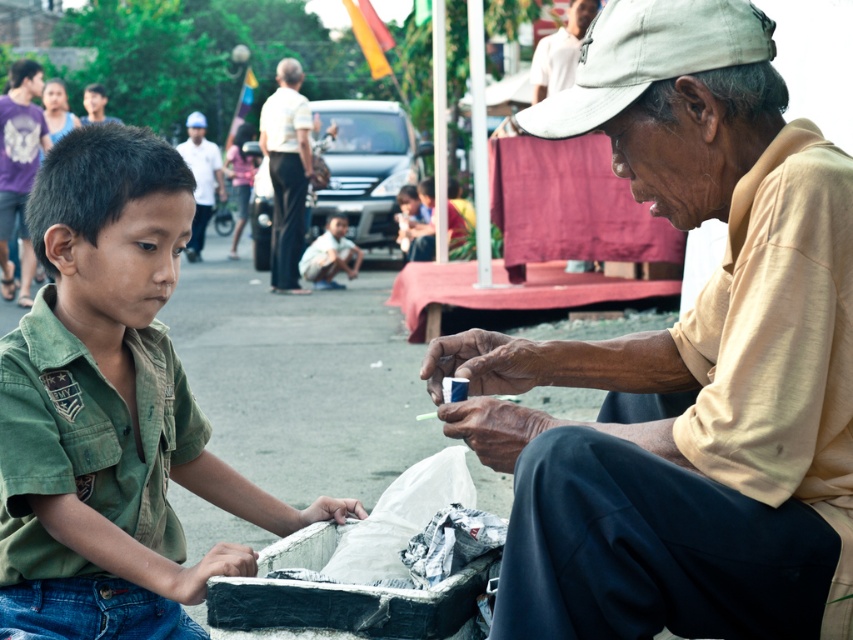
Can you confirm if green matte shirt at left is shorter than white cotton shirt at upper center?

Correct, green matte shirt at left is not as tall as white cotton shirt at upper center.

Is point (62, 422) closer to camera compared to point (259, 120)?

Yes, it is.

Is point (103, 586) positioned before point (293, 227)?

Yes, it is.

Find the location of a particular element. Image resolution: width=853 pixels, height=640 pixels. green matte shirt at left is located at coordinates (109, 410).

Which is more to the left, light beige cotton shirt at right or green matte shirt at left?

Positioned to the left is green matte shirt at left.

Between point (613, 422) and point (67, 244), which one is positioned in front?

Point (613, 422) is more forward.

Does point (729, 378) lie in front of point (265, 500)?

Yes.

Where is `light beige cotton shirt at right`? light beige cotton shirt at right is located at coordinates (686, 364).

Between light beige cotton shirt at right and white cotton shirt at upper center, which one is positioned higher?

Positioned higher is white cotton shirt at upper center.

Does light beige cotton shirt at right lie in front of white cotton shirt at upper center?

Yes, it is in front of white cotton shirt at upper center.

Identify the location of light beige cotton shirt at right. This screenshot has height=640, width=853. (686, 364).

Where is `light beige cotton shirt at right`? light beige cotton shirt at right is located at coordinates (686, 364).